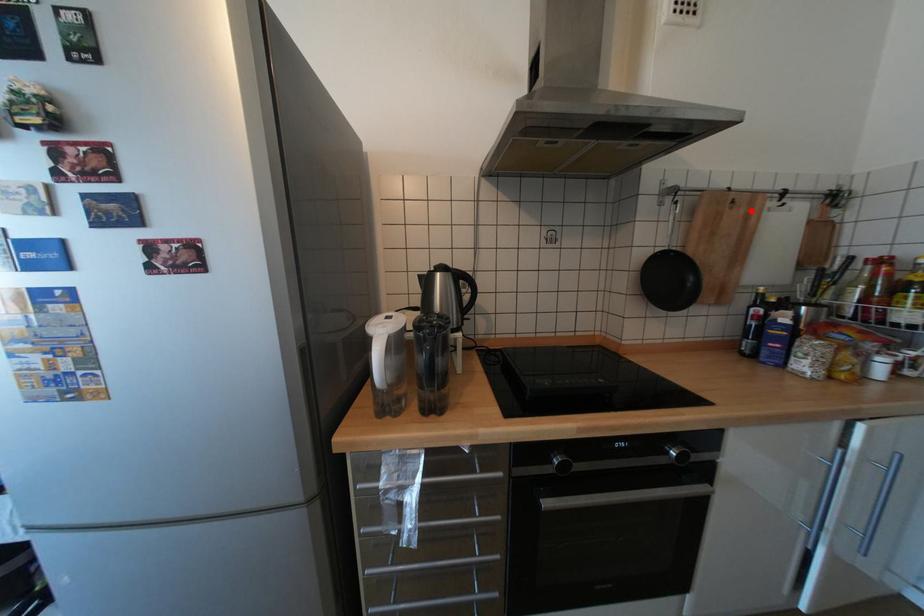
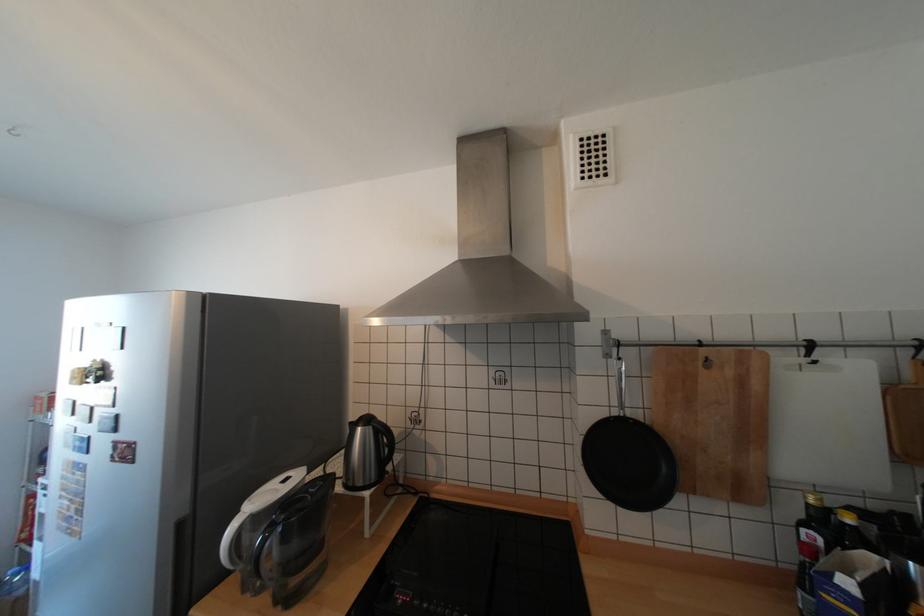
Where in the second image is the point corresponding to the highlighted location from the first image?

(738, 371)